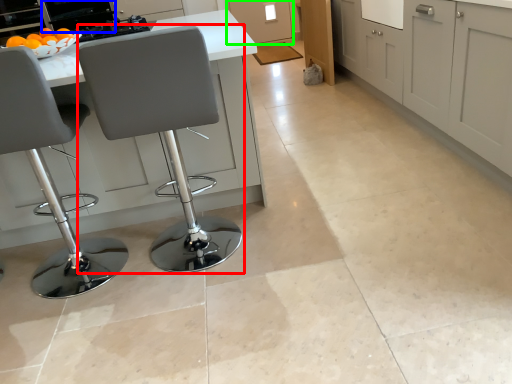
Question: Estimate the real-world distances between objects in this image. Which object is closer to chair (highlighted by a red box), appliance (highlighted by a blue box) or cabinetry (highlighted by a green box)?

Choices:
 (A) appliance
 (B) cabinetry

Answer: (A)